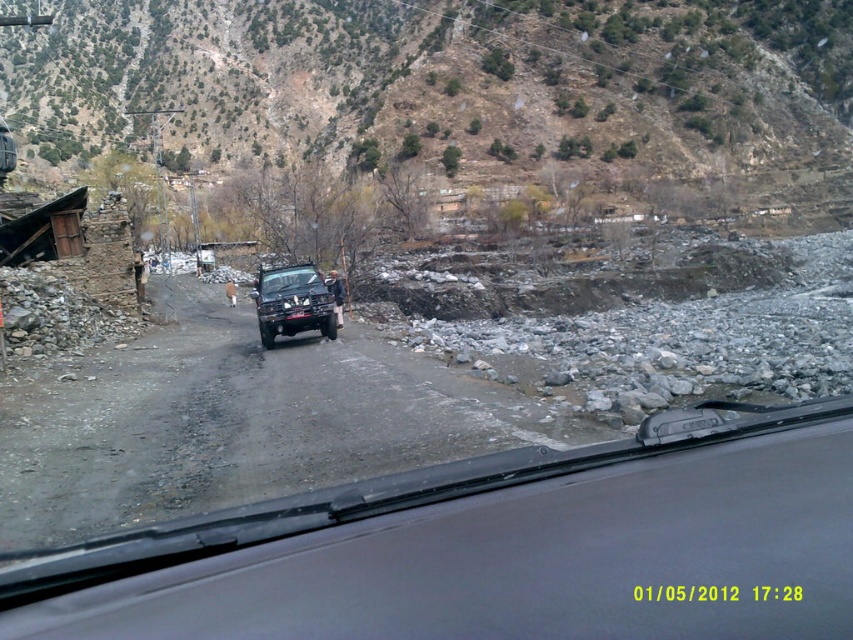
You are a passenger in the vehicle and want to know which of the two points, point [546,115] or point [253,292], is closer to the camera. Based on the scene description, can you determine which point is closer?

Point [253,292] is closer to the camera than point [546,115], as the description states that point [546,115] is further away.

You are a driver trying to navigate through a narrow dirt road. You notice the black rubber windshield at center and the brown rocky hillside at upper center. Which of these two objects is shorter in height?

The black rubber windshield at center has a lesser height compared to the brown rocky hillside at upper center, so the black rubber windshield at center is shorter.

You are a driver who wants to know if the black rubber windshield at center can fully cover the brown rocky hillside at upper center when viewed from your current position. Based on their sizes, what is your assessment?

The black rubber windshield at center is smaller than the brown rocky hillside at upper center, so it cannot fully cover it.